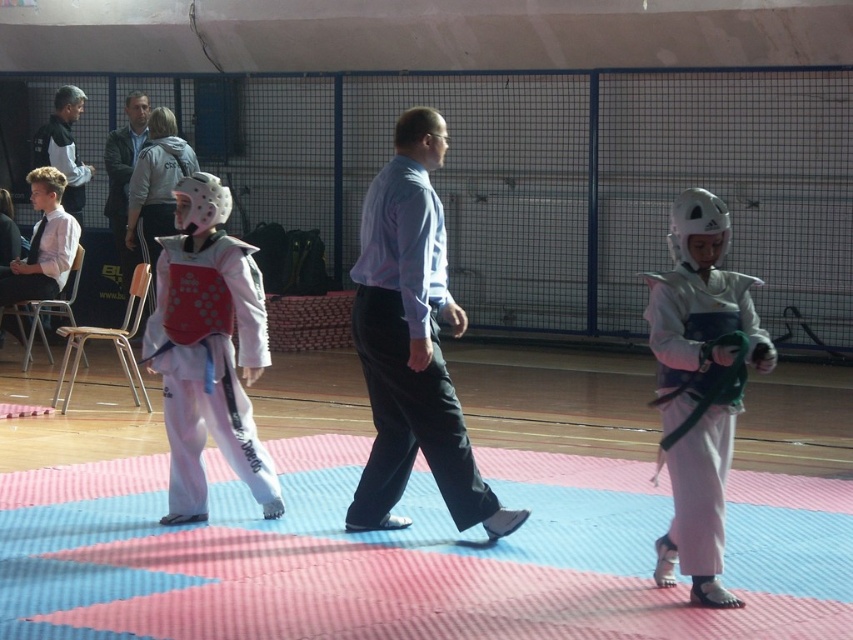
You are a judge observing a martial arts competition. You notice two participants wearing the white matte karate uniform at left and the black jacket at upper left. Which participant is positioned more to the left side of the mat?

The black jacket at upper left is positioned more to the left side of the mat compared to the white matte karate uniform at left.

You are a referee observing the martial arts sparring match. You notice two points marked on the mat where the participants are positioned. Which point is closer to you, the referee, between point (123, 196) and point (68, 88)?

Point (123, 196) is in front of point (68, 88), so the point closer to you is point (123, 196).